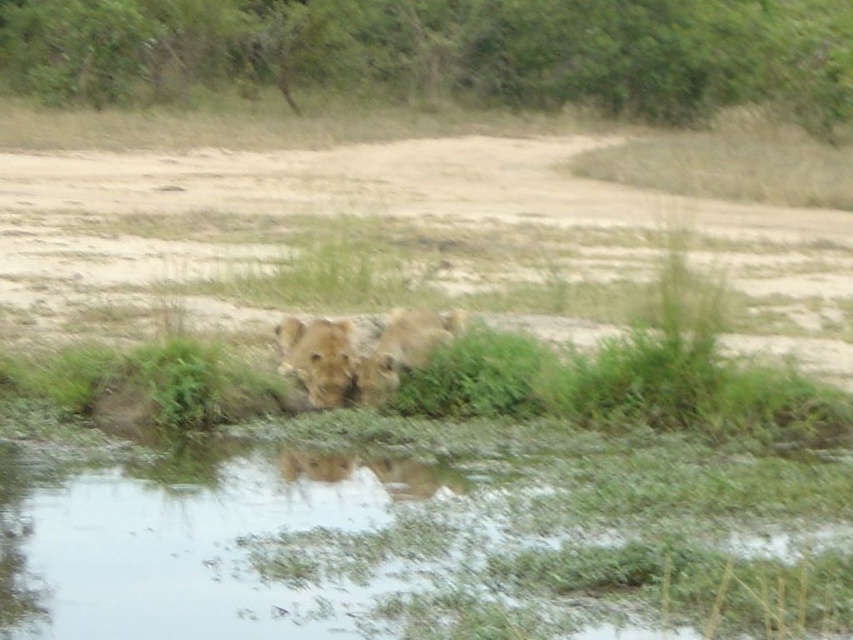
You are a photographer trying to capture the fuzzy golden lion at center without the clear water at lower center reflecting too much light. What adjustment can you make to your camera angle to minimize the reflection?

Since the clear water at lower center is positioned under the fuzzy golden lion at center, tilting the camera upwards slightly would angle the lens away from the reflective surface of the water, reducing glare and allowing a clearer view of the fuzzy golden lion at center.

You are a wildlife photographer aiming to capture a clear shot of the fuzzy golden lion at center. You notice a point marked at coordinates (318,356). Where exactly on the lion is this point located?

The point at coordinates (318,356) is located on the fuzzy golden lion at center.

In the scene shown: You are a photographer trying to capture the fuzzy golden lion at center without the clear water at lower center reflecting too much light. Based on the scene, which object is wider, potentially causing more reflection? Please answer with the object label.

The clear water at lower center is wider than the fuzzy golden lion at center, so it might cause more reflection.